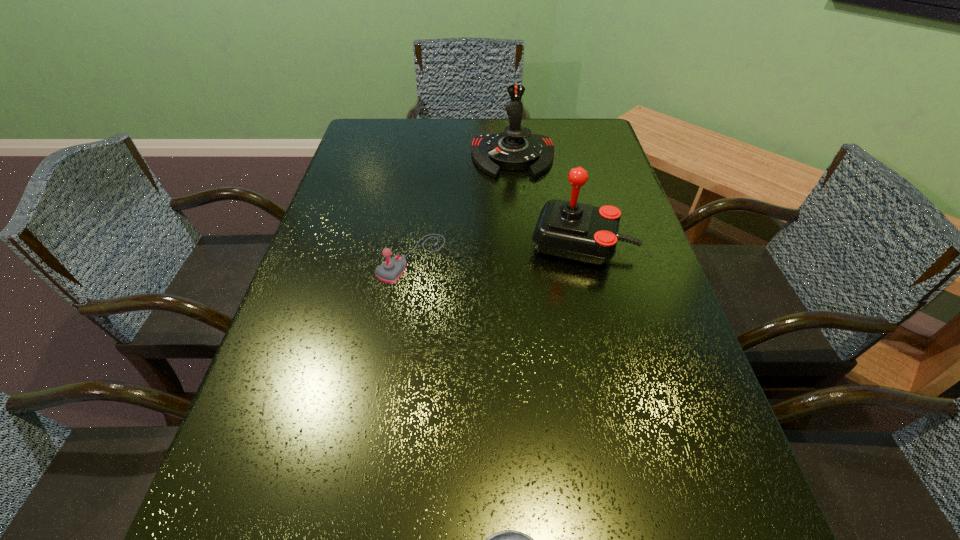
Identify the location of the farthest object. (516, 148).

At what (x,y) coordinates should I click in order to perform the action: click on the leftmost object. Please return your answer as a coordinate pair (x, y). The image size is (960, 540). Looking at the image, I should click on (391, 270).

Where is `the leftmost joystick`? The width and height of the screenshot is (960, 540). the leftmost joystick is located at coordinates (391, 270).

Where is `blank space located on the handle side of the farthest joystick`? The width and height of the screenshot is (960, 540). blank space located on the handle side of the farthest joystick is located at coordinates (519, 225).

Locate an element on the screen. The image size is (960, 540). blank space located 0.270m on the back of the shortest joystick is located at coordinates pyautogui.click(x=425, y=172).

Identify the location of object that is at the far edge. This screenshot has height=540, width=960. (516, 148).

Identify the location of object present at the left edge. (391, 270).

Identify the location of object that is positioned at the right edge. The width and height of the screenshot is (960, 540). (581, 232).

Identify the location of vacant area at the far edge. click(445, 157).

Find the location of `vacant region at the left edge of the desktop`. vacant region at the left edge of the desktop is located at coordinates (341, 320).